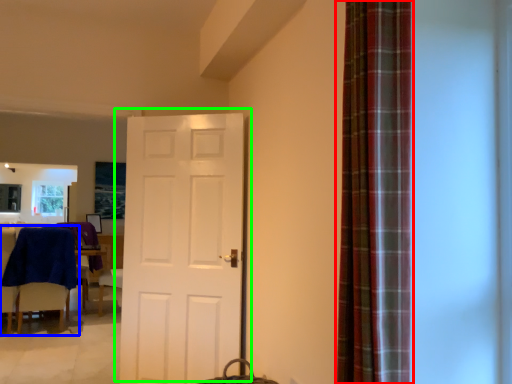
Question: Estimate the real-world distances between objects in this image. Which object is closer to curtain (highlighted by a red box), chair (highlighted by a blue box) or door (highlighted by a green box)?

Choices:
 (A) chair
 (B) door

Answer: (B)